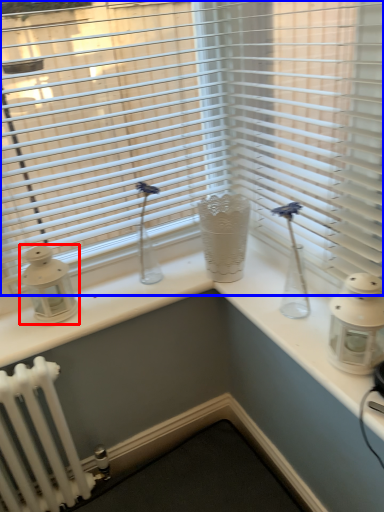
Question: Which of the following is the closest to the observer, candle holder (highlighted by a red box) or window blind (highlighted by a blue box)?

Choices:
 (A) candle holder
 (B) window blind

Answer: (B)